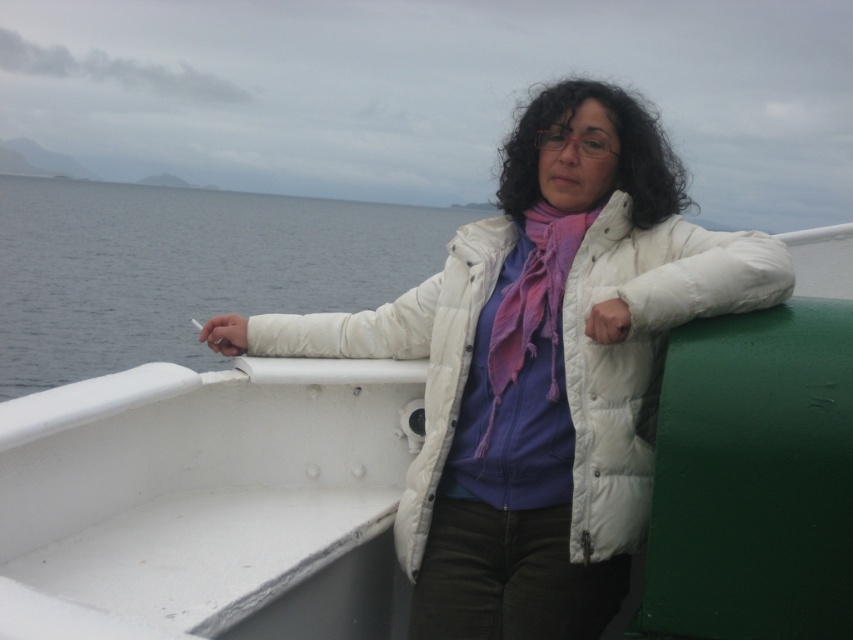
You are a photographer trying to capture a portrait of the person in the white puffy jacket at center without the blue water at left being visible in the background. Based on the scene description, is this possible?

The white puffy jacket at center is in front of the blue water at left, so if you position yourself so that the jacket blocks the view of the water behind it, you can take the portrait without the blue water at left visible in the background.